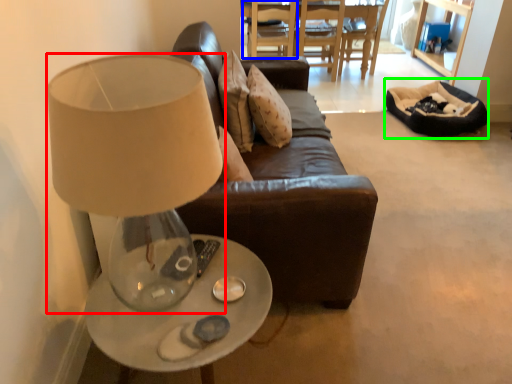
Question: Which is nearer to the lamp (highlighted by a red box)? chair (highlighted by a blue box) or bean bag chair (highlighted by a green box).

Choices:
 (A) chair
 (B) bean bag chair

Answer: (B)